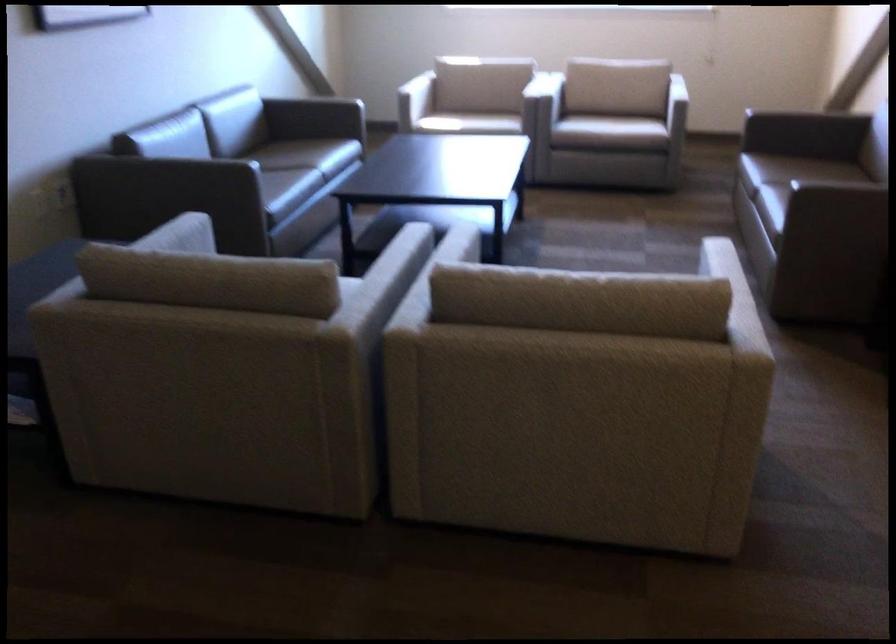
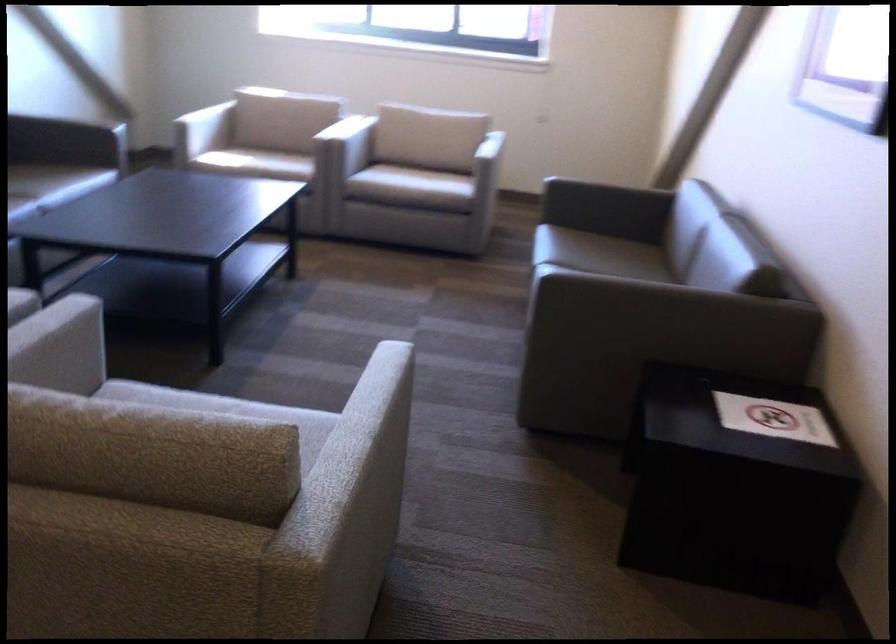
The point at (406, 97) is marked in the first image. Where is the corresponding point in the second image?

(202, 131)